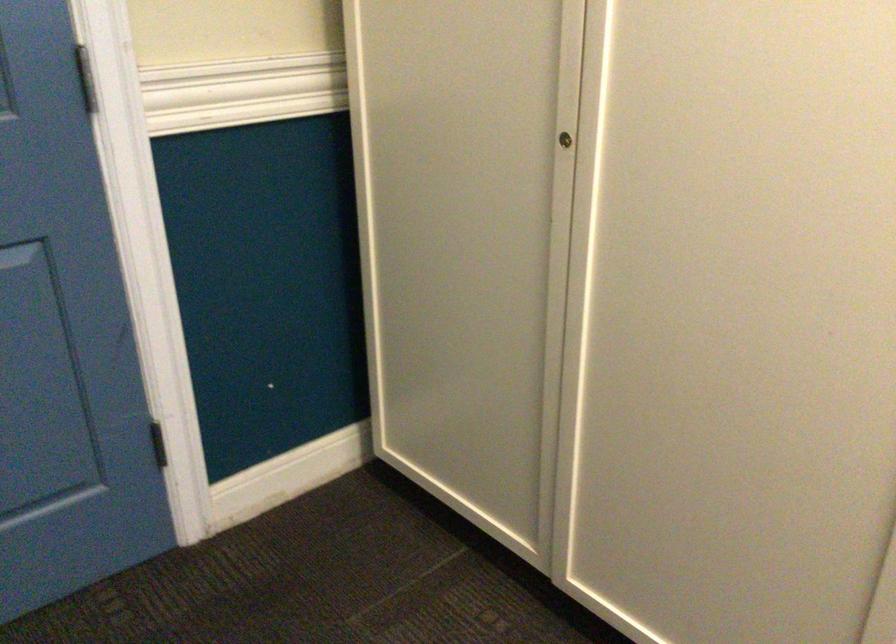
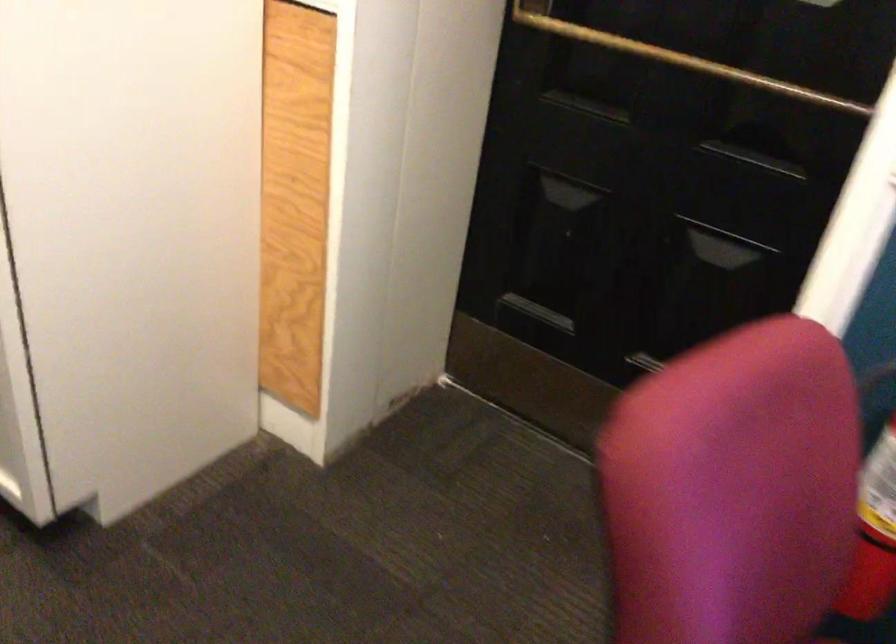
Question: The images are taken continuously from a first-person perspective. In which direction are you moving?

Choices:
 (A) Left
 (B) Right
 (C) Forward
 (D) Backward

Answer: (B)